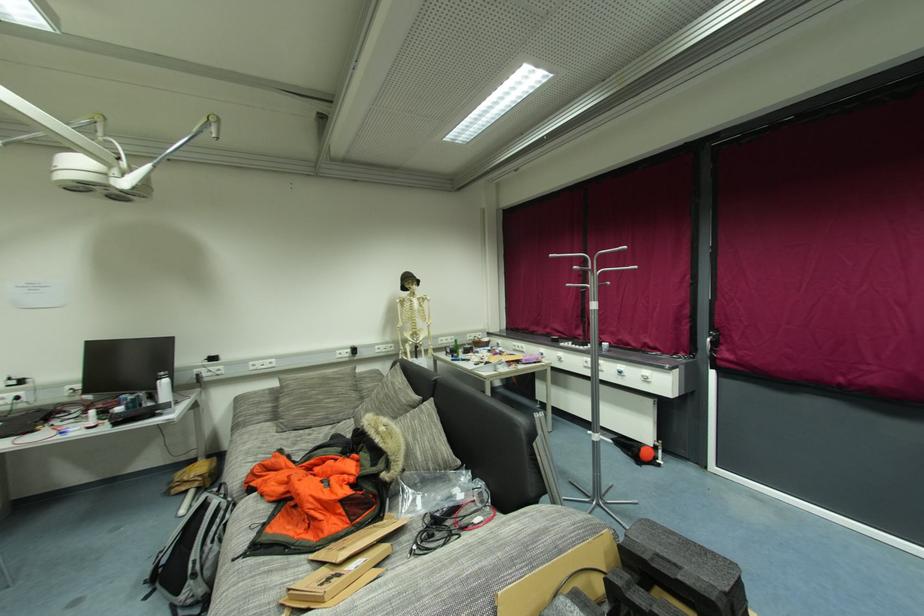
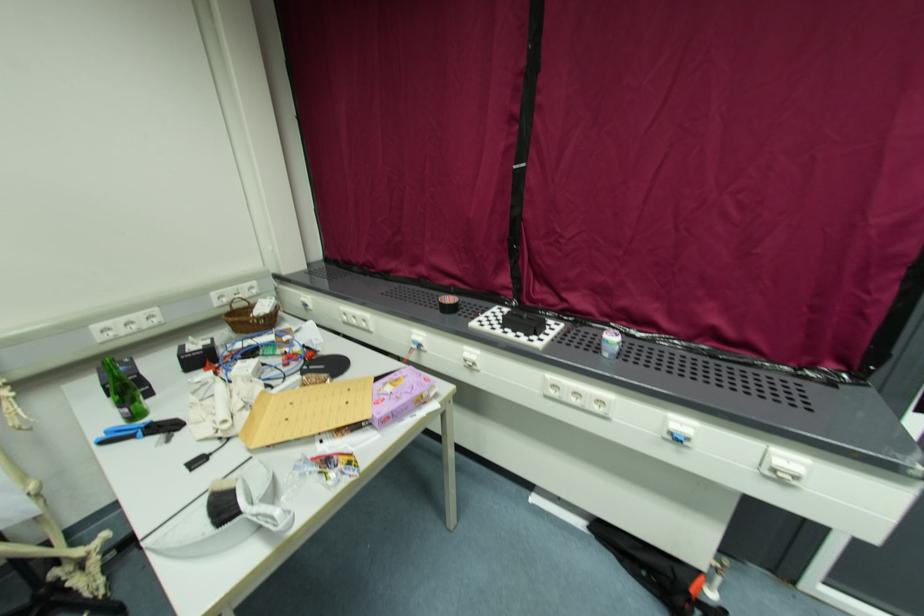
Question: I am providing you with two images of the same scene from different viewpoints. Which of the following objects are not visible in image2?

Choices:
 (A) blue tool handles
 (B) purple cardboard box
 (C) white cleaning tool handle
 (D) none of these

Answer: (D)